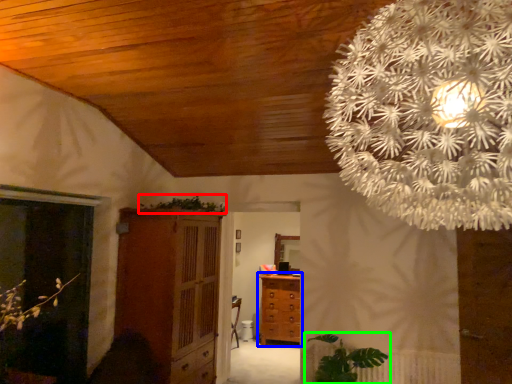
Question: Which is nearer to the plant (highlighted by a red box)? chest of drawers (highlighted by a blue box) or houseplant (highlighted by a green box).

Choices:
 (A) chest of drawers
 (B) houseplant

Answer: (A)